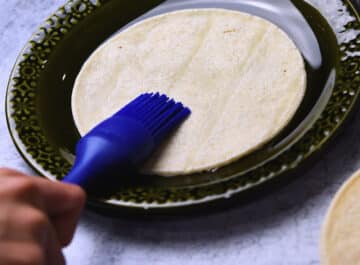
The width and height of the screenshot is (360, 265). Find the location of `plate design`. plate design is located at coordinates (26, 109).